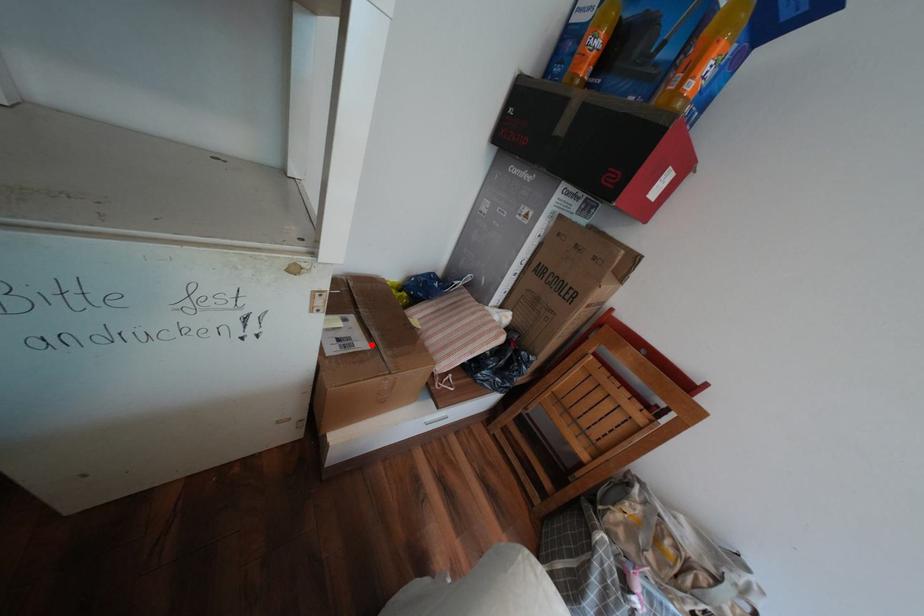
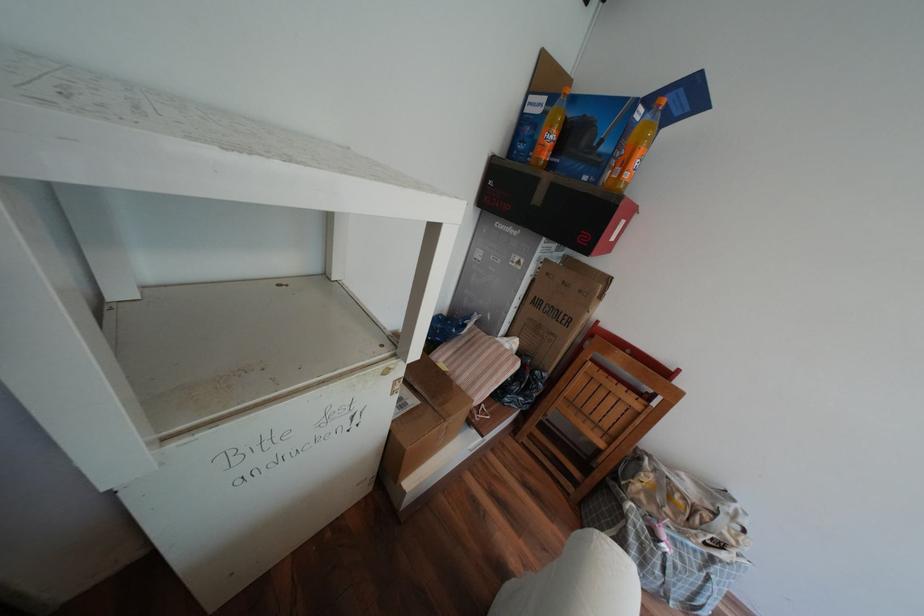
Question: I am providing you with two images of the same scene from different viewpoints. Image1 has a red point marked. In image2, the corresponding 3D location appears at what relative position? Reply with the corresponding letter.

Choices:
 (A) Closer
 (B) Farther

Answer: (B)